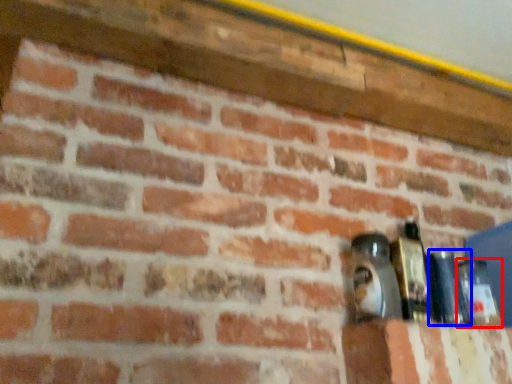
Question: Which point is further to the camera, bottle (highlighted by a red box) or bottle (highlighted by a blue box)?

Choices:
 (A) bottle
 (B) bottle

Answer: (A)